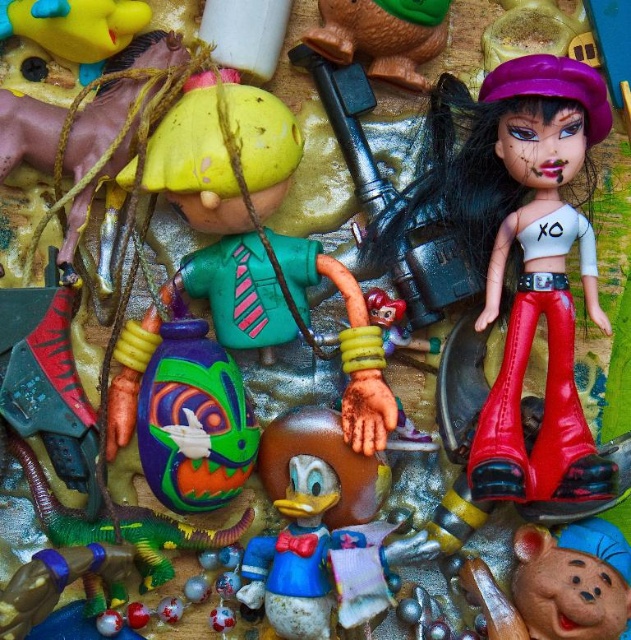
Question: Does shiny red leather pants at right have a greater width compared to rubber duck at upper center?

Choices:
 (A) no
 (B) yes

Answer: (B)

Question: Considering the real-world distances, which object is farthest from the rubber duck at upper center?

Choices:
 (A) smooth brown bear at center
 (B) shiny red leather pants at right

Answer: (A)

Question: Can you confirm if smooth brown bear at center is positioned to the left of rubber duck at upper center?

Choices:
 (A) yes
 (B) no

Answer: (B)

Question: Is shiny red leather pants at right positioned at the back of rubber duck at upper center?

Choices:
 (A) no
 (B) yes

Answer: (A)

Question: Estimate the real-world distances between objects in this image. Which object is farther from the smooth brown bear at center?

Choices:
 (A) shiny red leather pants at right
 (B) rubber duck at upper center

Answer: (B)

Question: Which of these objects is positioned closest to the rubber duck at upper center?

Choices:
 (A) smooth brown bear at center
 (B) shiny red leather pants at right

Answer: (B)